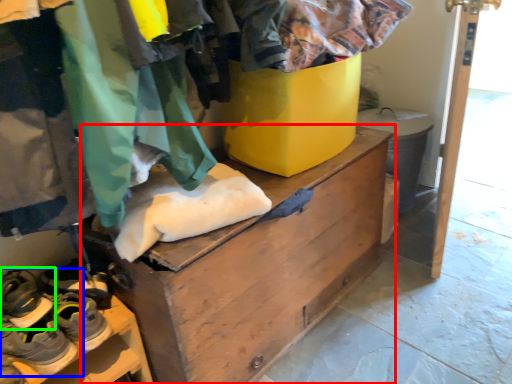
Question: Which object is the closest to the chest of drawers (highlighted by a red box)? Choose among these: footwear (highlighted by a blue box) or footwear (highlighted by a green box).

Choices:
 (A) footwear
 (B) footwear

Answer: (A)